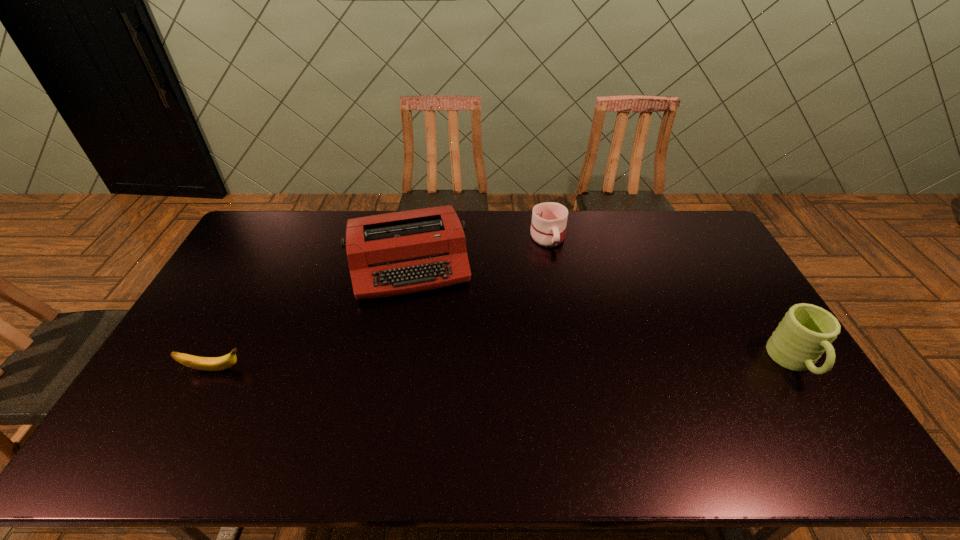
Identify the location of vacant area that lies between the typewriter and the left mug. (479, 251).

The width and height of the screenshot is (960, 540). In order to click on blank region between the third tallest object and the taller mug in this screenshot , I will do `click(671, 300)`.

The height and width of the screenshot is (540, 960). Find the location of `vacant region between the taller mug and the banana`. vacant region between the taller mug and the banana is located at coordinates (504, 366).

Find the location of `free space that is in between the second object from right to left and the rightmost object`. free space that is in between the second object from right to left and the rightmost object is located at coordinates (671, 300).

Locate which object is the second closest to the third tallest object. Please provide its 2D coordinates. Your answer should be formatted as a tuple, i.e. [(x, y)], where the tuple contains the x and y coordinates of a point satisfying the conditions above.

[(806, 331)]

Locate an element on the screen. The height and width of the screenshot is (540, 960). object that can be found as the third closest to the second object from right to left is located at coordinates (201, 363).

Where is `vacant region that satisfies the following two spatial constraints: 1. on the back side of the typewriter; 2. on the right side of the left mug`? The height and width of the screenshot is (540, 960). vacant region that satisfies the following two spatial constraints: 1. on the back side of the typewriter; 2. on the right side of the left mug is located at coordinates (415, 237).